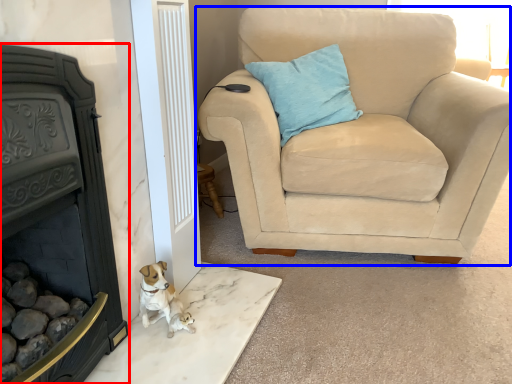
Question: Which point is closer to the camera, fireplace (highlighted by a red box) or chair (highlighted by a blue box)?

Choices:
 (A) fireplace
 (B) chair

Answer: (A)